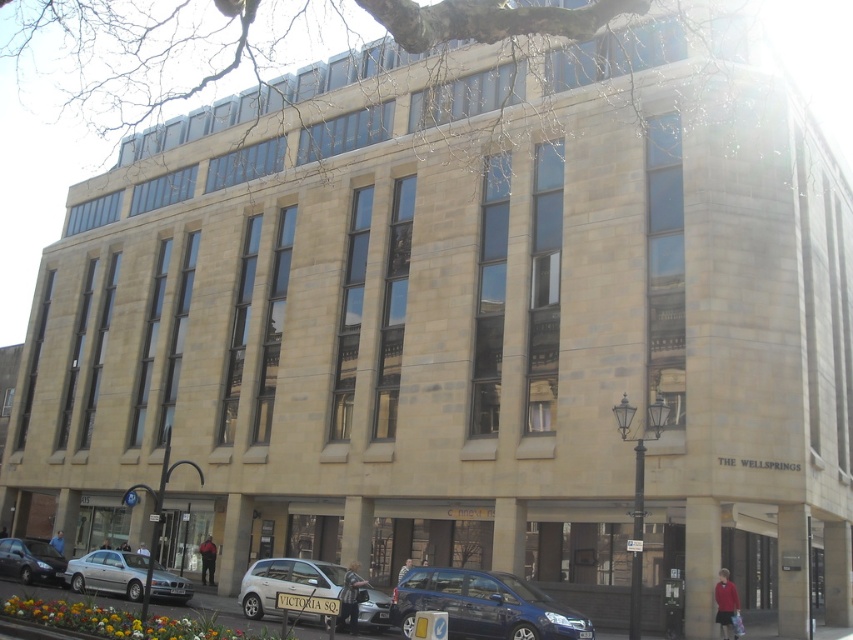
Question: Based on their relative distances, which object is farther from the silver metallic hatchback at lower center?

Choices:
 (A) shiny black sedan at lower left
 (B) metallic blue van at lower center
 (C) silver metallic sedan at lower left

Answer: (A)

Question: Considering the relative positions of metallic blue van at lower center and shiny black sedan at lower left in the image provided, where is metallic blue van at lower center located with respect to shiny black sedan at lower left?

Choices:
 (A) right
 (B) left

Answer: (A)

Question: Which point is closer to the camera?

Choices:
 (A) silver metallic sedan at lower left
 (B) shiny black sedan at lower left

Answer: (A)

Question: Does silver metallic hatchback at lower center appear on the left side of silver metallic sedan at lower left?

Choices:
 (A) yes
 (B) no

Answer: (B)

Question: Among these points, which one is nearest to the camera?

Choices:
 (A) (299, 577)
 (B) (47, 563)
 (C) (468, 598)
 (D) (86, 573)

Answer: (C)

Question: Can you confirm if metallic blue van at lower center is thinner than silver metallic hatchback at lower center?

Choices:
 (A) yes
 (B) no

Answer: (A)